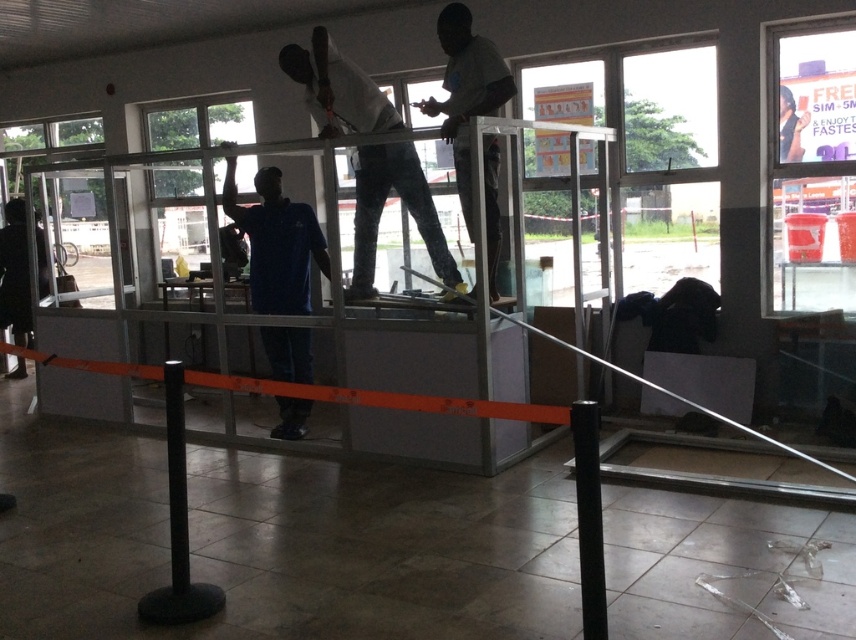
You are a security guard observing the scene. You need to check the identity of the person closest to you. Which person should you approach first, the light blue shirt at center or the white matte shirt at upper center?

The light blue shirt at center is closer to you, so you should approach them first.

You are an observer standing in the middle of the room. You notice the white matte shirt at upper center and the black rubber pole at lower left. Which object is wider?

The white matte shirt at upper center is wider than the black rubber pole at lower left.